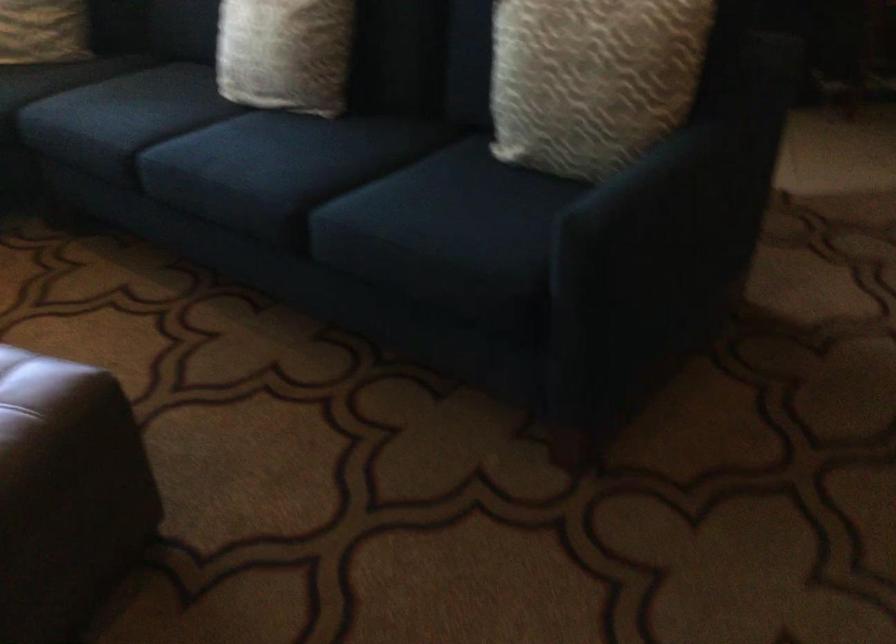
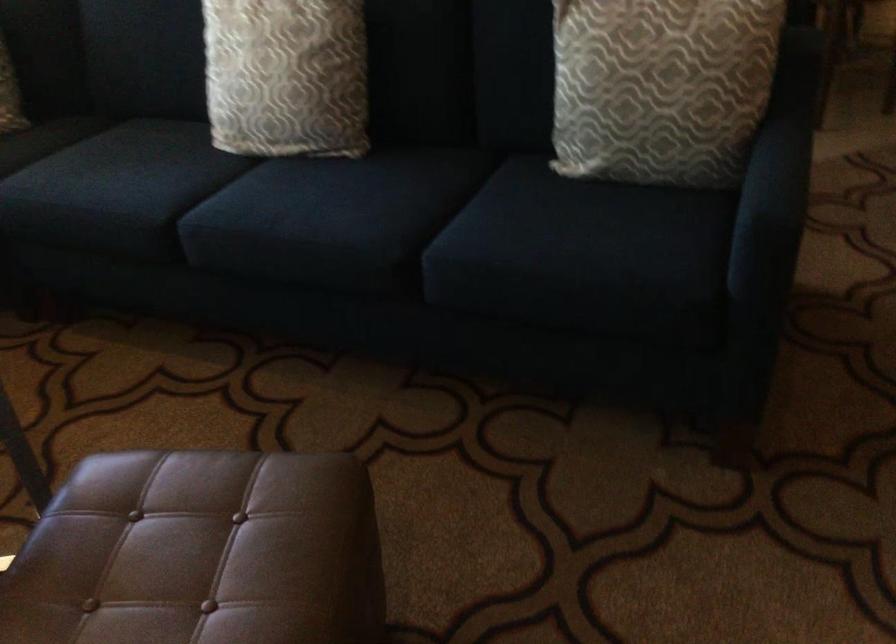
Question: Which direction would the cameraman need to move to produce the second image? Reply with the corresponding letter.

Choices:
 (A) Left
 (B) Right
 (C) Forward
 (D) Backward

Answer: (A)